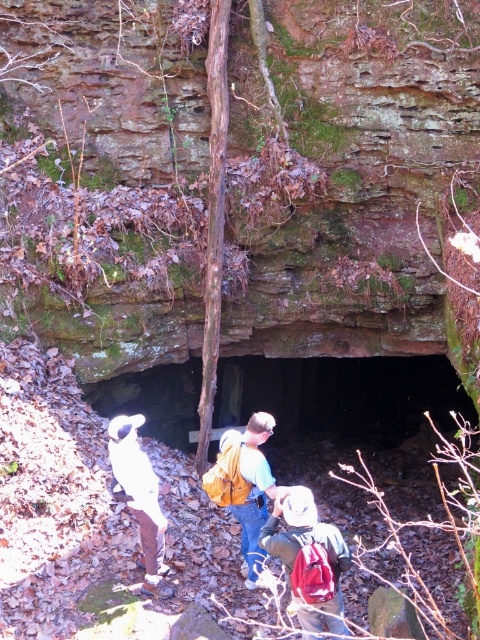
You are one of the explorers standing near the cave entrance. You notice the yellow backpack at center and the white fabric shirt at center. Which object is closer to you?

The yellow backpack at center is closer to you because it is further to the viewer than the white fabric shirt at center.